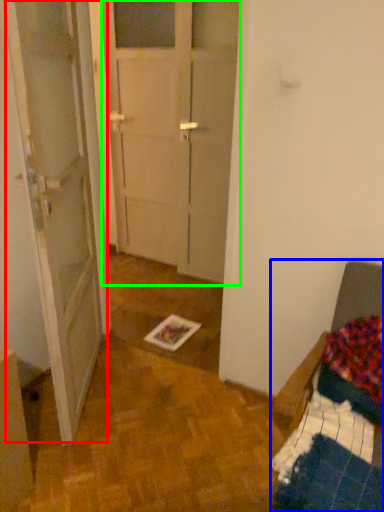
Question: Estimate the real-world distances between objects in this image. Which object is closer to barn door (highlighted by a red box), furniture (highlighted by a blue box) or glass door (highlighted by a green box)?

Choices:
 (A) furniture
 (B) glass door

Answer: (B)